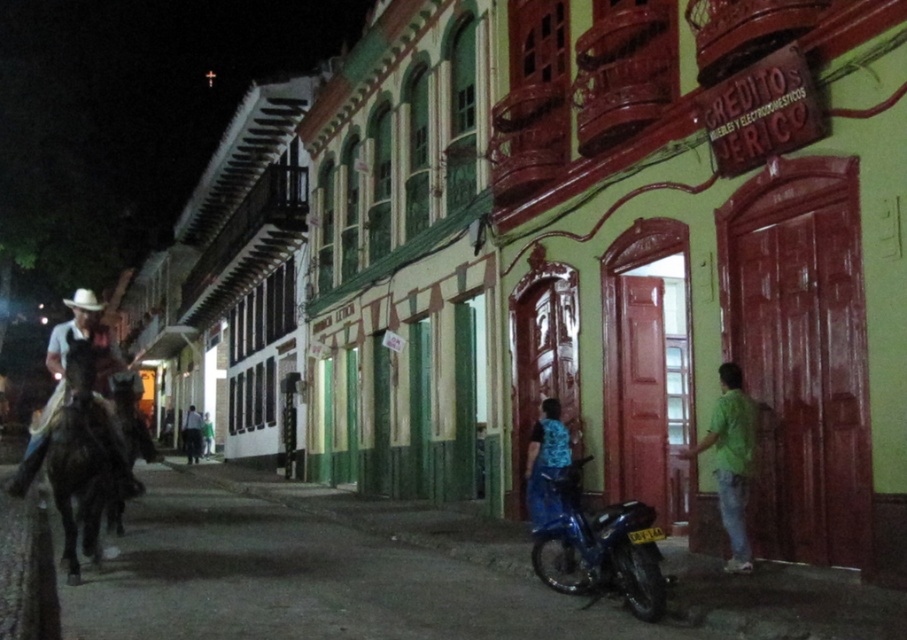
Question: Can you confirm if shiny blue motorbike at lower center is smaller than brown glossy horse at left?

Choices:
 (A) no
 (B) yes

Answer: (B)

Question: Among these points, which one is farthest from the camera?

Choices:
 (A) (71, 428)
 (B) (535, 474)

Answer: (B)

Question: Which of the following is the closest to the observer?

Choices:
 (A) (639, 550)
 (B) (539, 500)

Answer: (A)

Question: Can you confirm if brown glossy horse at left is positioned below green cotton shirt at right?

Choices:
 (A) yes
 (B) no

Answer: (A)

Question: Does blue denim jeans at lower center appear on the left side of dark blue jeans at center?

Choices:
 (A) yes
 (B) no

Answer: (B)

Question: Among these objects, which one is farthest from the camera?

Choices:
 (A) light blue denim shirt at left
 (B) blue denim jeans at lower center
 (C) green cotton shirt at right

Answer: (B)